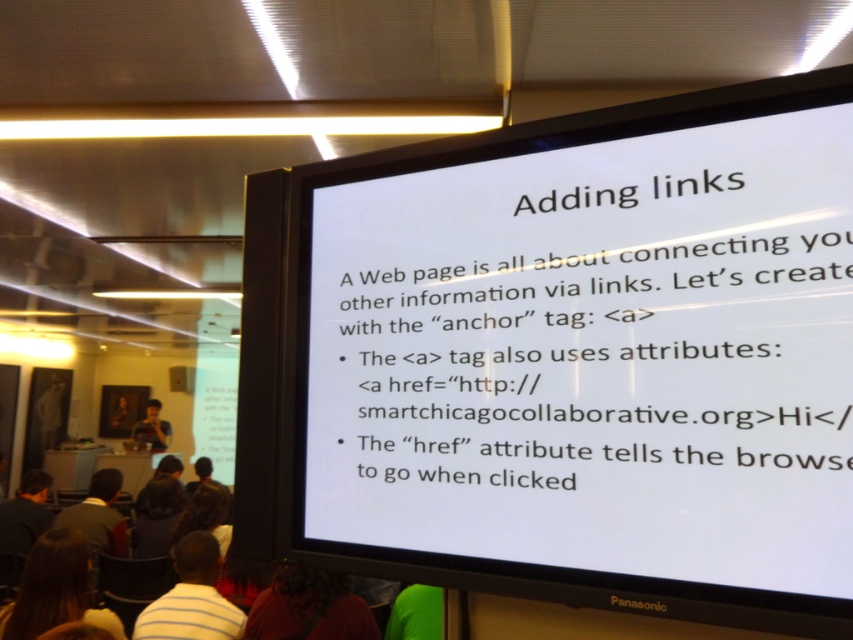
You are a student attending the presentation and want to take a photo of the white paper at upper center using the matte black camera at lower left. Can you do this without moving either object?

The white paper at upper center is positioned over the matte black camera at lower left, so you cannot take a photo of the white paper at upper center using the matte black camera at lower left without moving one of them because the camera is blocked by the paper.

You are a photographer attending a presentation and notice both the brown hair at lower left and the matte black camera at lower left. Which object is located to the right of the other?

The brown hair at lower left is positioned on the right side of matte black camera at lower left.

What is the relationship between the brown hair at lower left and the matte black camera at lower left in terms of their positions?

The brown hair at lower left is positioned over the matte black camera at lower left.